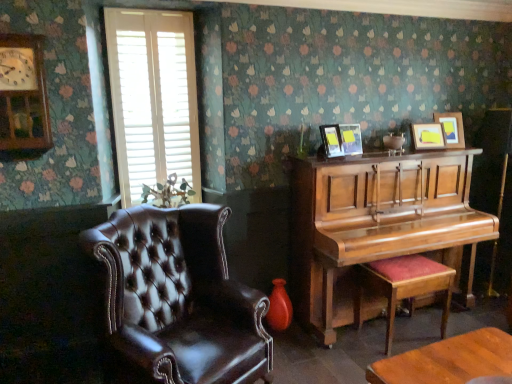
Question: Does wooden polished stool at right touch white wood blinds at upper left?

Choices:
 (A) no
 (B) yes

Answer: (A)

Question: From a real-world perspective, is wooden polished stool at right physically below white wood blinds at upper left?

Choices:
 (A) yes
 (B) no

Answer: (A)

Question: Is wooden polished stool at right bigger than white wood blinds at upper left?

Choices:
 (A) no
 (B) yes

Answer: (B)

Question: From the image's perspective, is wooden polished stool at right over white wood blinds at upper left?

Choices:
 (A) no
 (B) yes

Answer: (A)

Question: Is wooden polished stool at right looking in the opposite direction of white wood blinds at upper left?

Choices:
 (A) no
 (B) yes

Answer: (A)

Question: From a real-world perspective, does wooden polished stool at right stand above white wood blinds at upper left?

Choices:
 (A) yes
 (B) no

Answer: (B)

Question: Is wooden picture frame at upper right, marked as the 1th picture frame in a right-to-left arrangement, far away from matte wooden picture frame at upper right, which ranks as the second picture frame in right-to-left order?

Choices:
 (A) no
 (B) yes

Answer: (A)

Question: From a real-world perspective, is wooden picture frame at upper right, marked as the 1th picture frame in a right-to-left arrangement, physically below matte wooden picture frame at upper right, which ranks as the second picture frame in right-to-left order?

Choices:
 (A) yes
 (B) no

Answer: (B)

Question: Does wooden picture frame at upper right, the 4th picture frame in the left-to-right sequence, have a larger size compared to matte wooden picture frame at upper right, which ranks as the second picture frame in right-to-left order?

Choices:
 (A) no
 (B) yes

Answer: (B)

Question: Can you confirm if wooden picture frame at upper right, the 4th picture frame in the left-to-right sequence, is thinner than matte wooden picture frame at upper right, placed as the third picture frame when sorted from left to right?

Choices:
 (A) yes
 (B) no

Answer: (B)

Question: Is wooden picture frame at upper right, marked as the 1th picture frame in a right-to-left arrangement, shorter than matte wooden picture frame at upper right, which ranks as the second picture frame in right-to-left order?

Choices:
 (A) no
 (B) yes

Answer: (A)

Question: From the image's perspective, does wooden picture frame at upper right, marked as the 1th picture frame in a right-to-left arrangement, appear higher than matte wooden picture frame at upper right, placed as the third picture frame when sorted from left to right?

Choices:
 (A) no
 (B) yes

Answer: (B)

Question: Considering the relative positions of wooden clock at upper left and white wood blinds at upper left in the image provided, is wooden clock at upper left to the left of white wood blinds at upper left from the viewer's perspective?

Choices:
 (A) no
 (B) yes

Answer: (B)